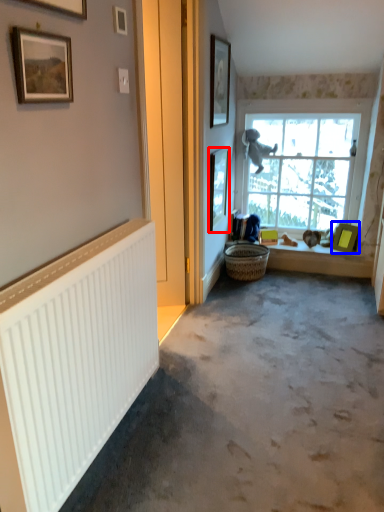
Question: Among these objects, which one is farthest to the camera, picture frame (highlighted by a red box) or picture frame (highlighted by a blue box)?

Choices:
 (A) picture frame
 (B) picture frame

Answer: (B)